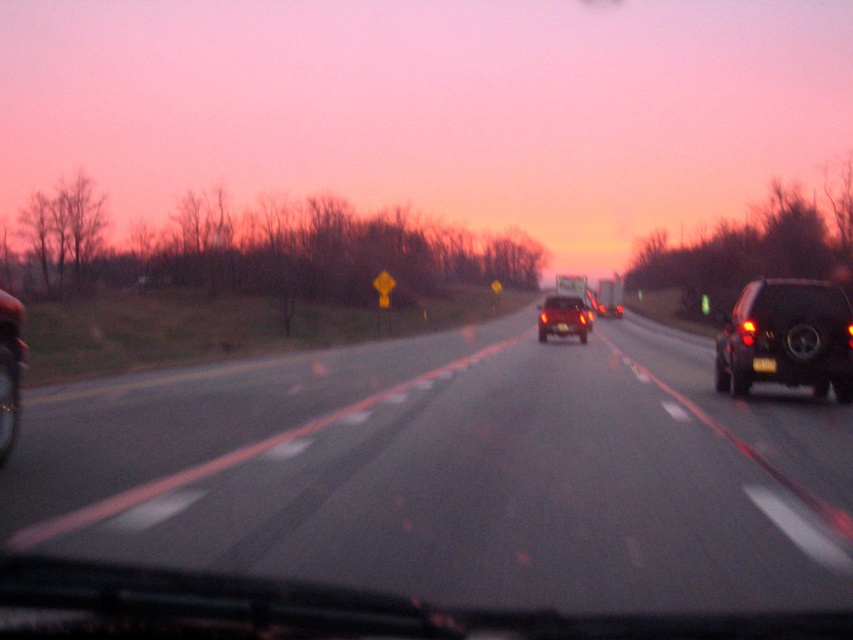
Can you confirm if black matte suv at right is taller than black plastic license plate at right?

Correct, black matte suv at right is much taller as black plastic license plate at right.

Image resolution: width=853 pixels, height=640 pixels. In order to click on black matte suv at right in this screenshot , I will do `click(787, 337)`.

Does point (576, 307) come closer to viewer compared to point (772, 371)?

No, (576, 307) is behind (772, 371).

Which is more to the left, matte black car at center or black plastic license plate at right?

Positioned to the left is black plastic license plate at right.

Does point (572, 320) come in front of point (756, 364)?

No, (572, 320) is further to viewer.

Locate an element on the screen. This screenshot has width=853, height=640. matte black car at center is located at coordinates (561, 317).

Is black asphalt highway at center positioned behind matte black car at center?

No, it is not.

Is black asphalt highway at center smaller than matte black car at center?

Indeed, black asphalt highway at center has a smaller size compared to matte black car at center.

Describe the element at coordinates (454, 474) in the screenshot. I see `black asphalt highway at center` at that location.

I want to click on black asphalt highway at center, so click(x=454, y=474).